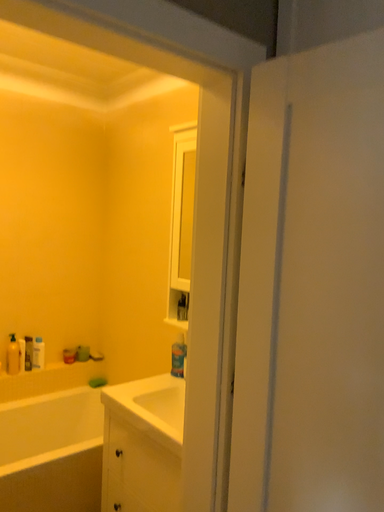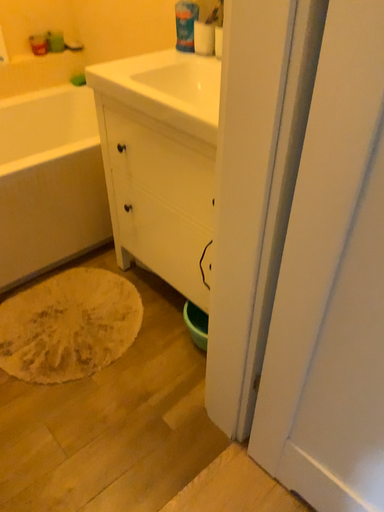
Question: How did the camera likely rotate when shooting the video?

Choices:
 (A) rotated upward
 (B) rotated downward

Answer: (B)